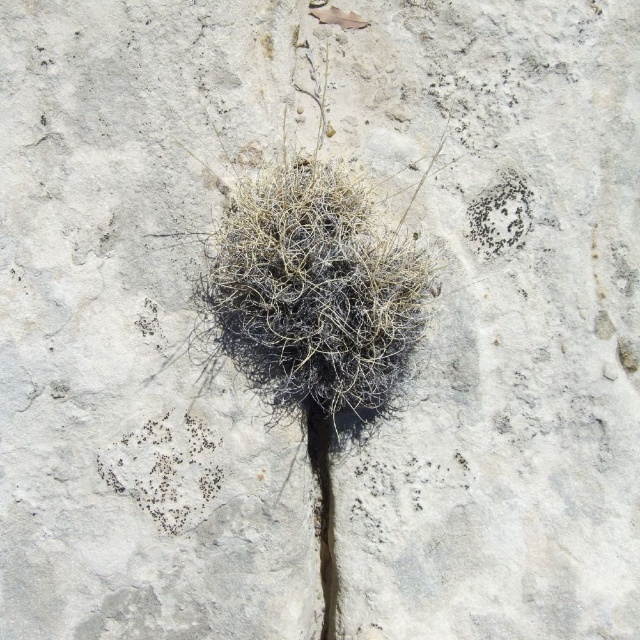
Can you confirm if black speckled rock at lower left is thinner than black speckled rock at upper right?

No.

Is black speckled rock at lower left below black speckled rock at upper right?

Correct, black speckled rock at lower left is located below black speckled rock at upper right.

Which is in front, point (157, 483) or point (493, 253)?

Point (157, 483)

Identify the location of black speckled rock at lower left. This screenshot has height=640, width=640. (164, 468).

Can you confirm if fuzzy black plant at center is positioned to the left of black speckled rock at lower left?

In fact, fuzzy black plant at center is to the right of black speckled rock at lower left.

Looking at this image, who is lower down, fuzzy black plant at center or black speckled rock at lower left?

black speckled rock at lower left is below.

Identify the location of fuzzy black plant at center. (316, 291).

Between fuzzy black plant at center and black speckled rock at upper right, which one appears on the right side from the viewer's perspective?

black speckled rock at upper right

Does fuzzy black plant at center have a larger size compared to black speckled rock at upper right?

Yes.

Is point (426, 284) less distant than point (483, 212)?

Yes, point (426, 284) is closer to viewer.

Locate an element on the screen. This screenshot has width=640, height=640. fuzzy black plant at center is located at coordinates (316, 291).